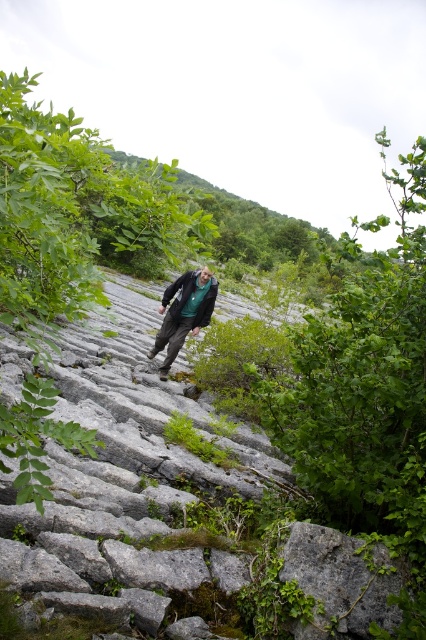
You are a hiker trying to step onto the gray rough stone at center while wearing the dark green textured jacket at center. Can you safely step on the stone without the jacket getting caught on the stone?

The gray rough stone at center might be wider than dark green textured jacket at center, so there is a possibility that the jacket could get caught if the stone is wide enough to accommodate the jacket.

You are a hiker trying to navigate the rocky terrain. You notice two jackets at the center of your view. The first is labeled as dark green fabric jacket at center, and the second is dark green textured jacket at center. Which jacket is closer to you?

The dark green fabric jacket at center is closer to you since it is positioned in front of the dark green textured jacket at center, as they are 11.77 inches apart.

You are a hiker trying to place your foot on the gray rough stone at center. Based on its position coordinates, can you confirm if the stone is located near the center of the image?

The gray rough stone at center is positioned at coordinates point (190, 515), which is near the center of the image.